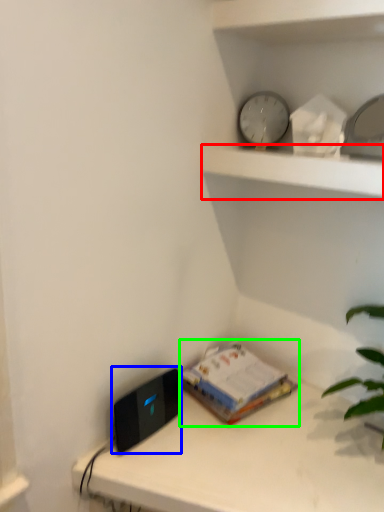
Question: Estimate the real-world distances between objects in this image. Which object is closer to shelf (highlighted by a red box), ipod (highlighted by a blue box) or paperback book (highlighted by a green box)?

Choices:
 (A) ipod
 (B) paperback book

Answer: (B)